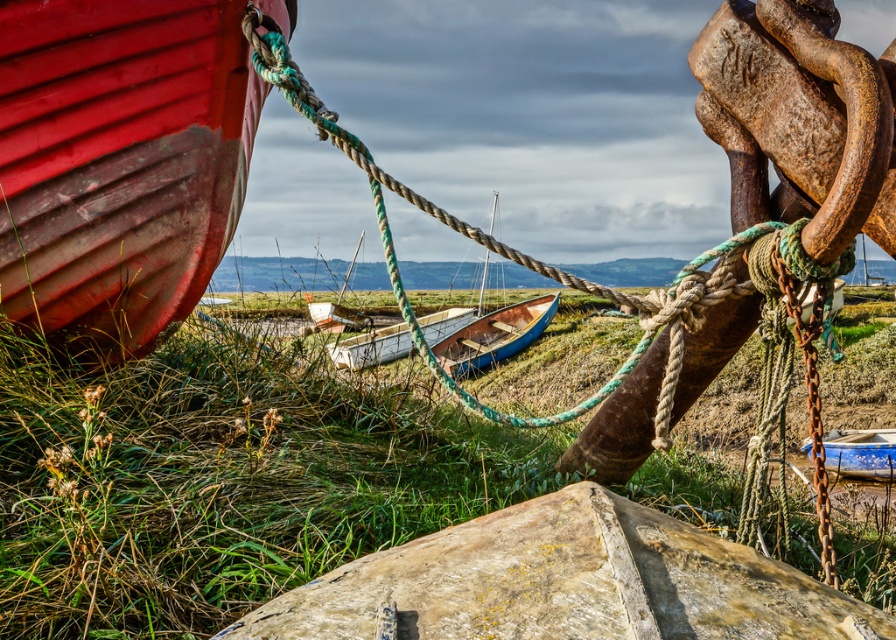
You are a photographer planning to capture both the matte wooden boat at left and the blue wooden boat at center in a single frame. Given their sizes, which boat should you position closer to the camera to ensure both appear balanced in the photo?

To balance the matte wooden boat at left and the blue wooden boat at center in the photo, position the smaller matte wooden boat at left closer to the camera since it is smaller than the blue wooden boat at center.

Looking at this image, you are standing at the point marked by the coordinates point (224,477) in the coastal scene. Looking around, you see the weathered wooden boat in the foreground and the red boat in the middle ground. Which boat is closer to your current position?

The point (224,477) is on green grass at lower left. Since the weathered wooden boat is in the foreground, it is closer to your position compared to the red boat in the middle ground.